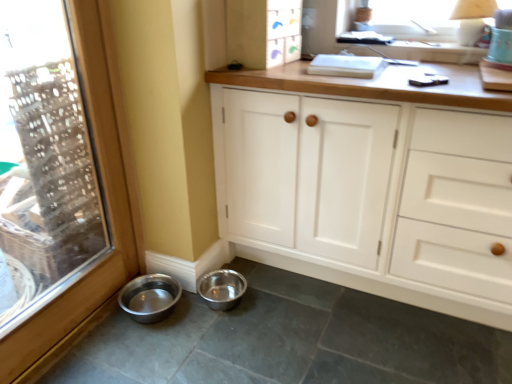
In order to click on vacant space underneath metallic silver bowl at lower left, acting as the second basin starting from the left (from a real-world perspective) in this screenshot , I will do `click(224, 290)`.